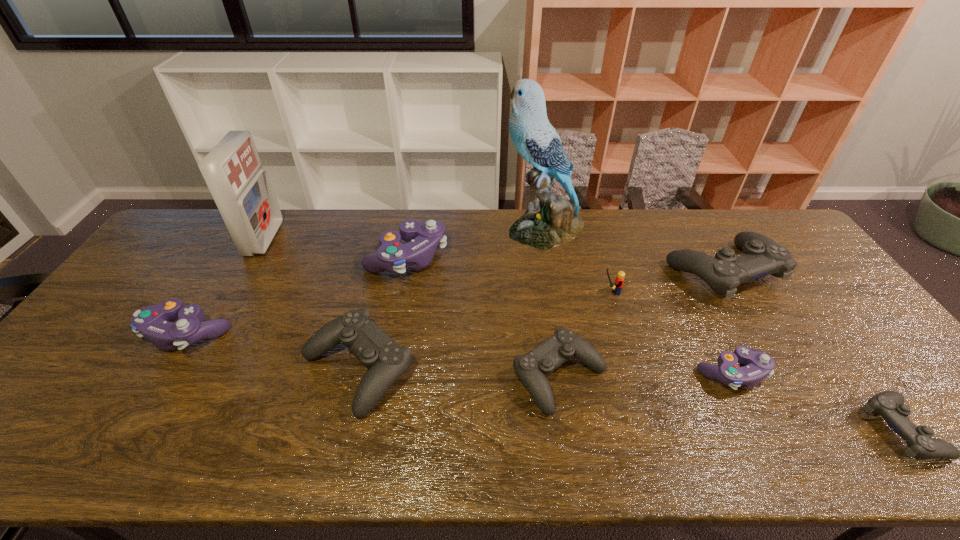
Where is `the third biggest gray control`? The height and width of the screenshot is (540, 960). the third biggest gray control is located at coordinates (532, 368).

This screenshot has height=540, width=960. In order to click on the third gray control from right to left in this screenshot , I will do `click(532, 368)`.

Find the location of a particular element. The image size is (960, 540). the rightmost purple control is located at coordinates click(759, 365).

Image resolution: width=960 pixels, height=540 pixels. Find the location of `free space located on the face of the parakeet`. free space located on the face of the parakeet is located at coordinates (469, 228).

At what (x,y) coordinates should I click in order to perform the action: click on free space located 0.160m on the face of the parakeet. Please return your answer as a coordinate pair (x, y). This screenshot has width=960, height=540. Looking at the image, I should click on (458, 228).

Identify the location of vacant space positioned 0.380m on the face of the parakeet. The height and width of the screenshot is (540, 960). (395, 228).

Where is `vacant area situated on the front-facing side of the first-aid kit`? The height and width of the screenshot is (540, 960). vacant area situated on the front-facing side of the first-aid kit is located at coordinates (387, 239).

Identify the location of free location located on the right of the second purple control from left to right. The width and height of the screenshot is (960, 540). (563, 257).

Locate an element on the screen. vacant position located on the front of the biggest gray control is located at coordinates (792, 388).

Locate an element on the screen. vacant area located on the front-facing side of the Lego is located at coordinates (531, 292).